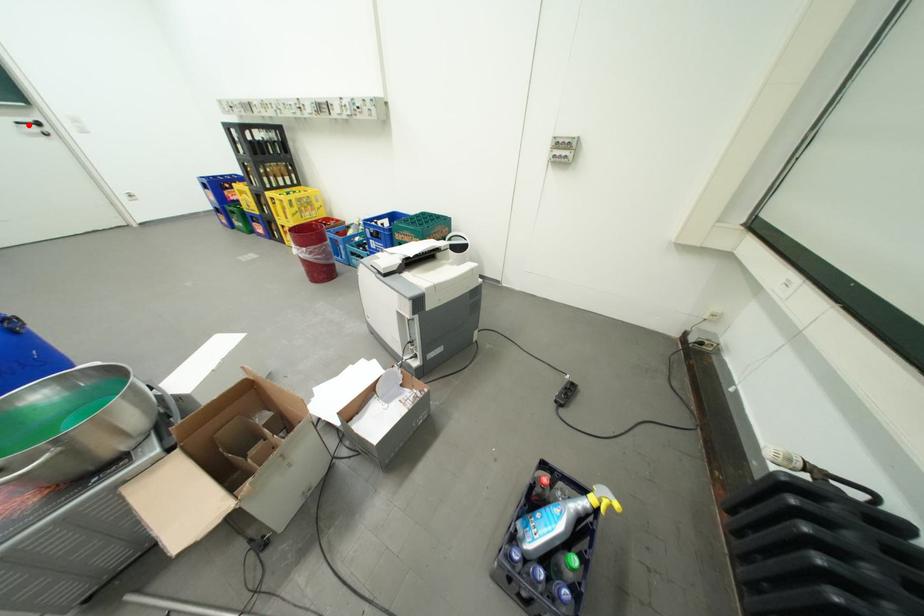
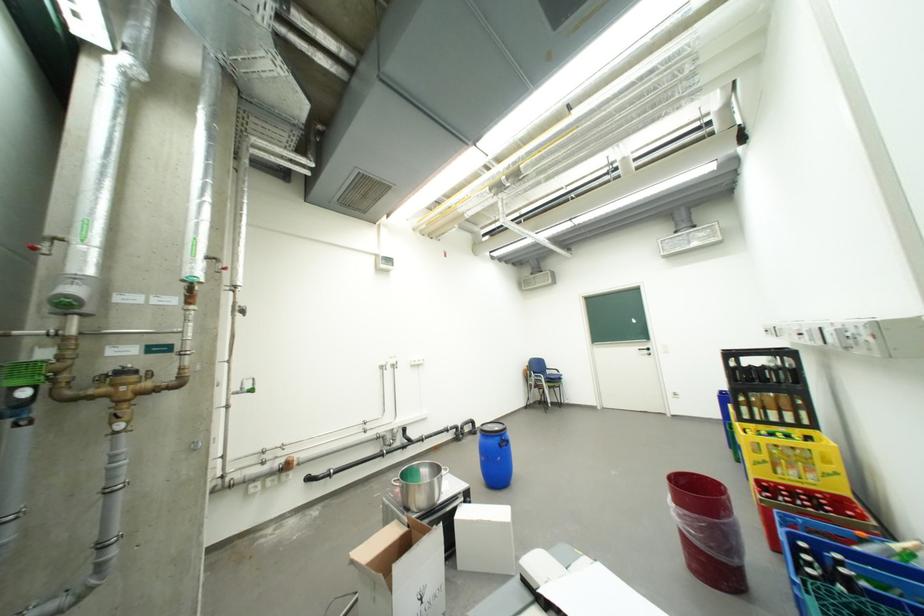
In the second image, find the point that corresponds to the highlighted location in the first image.

(650, 351)